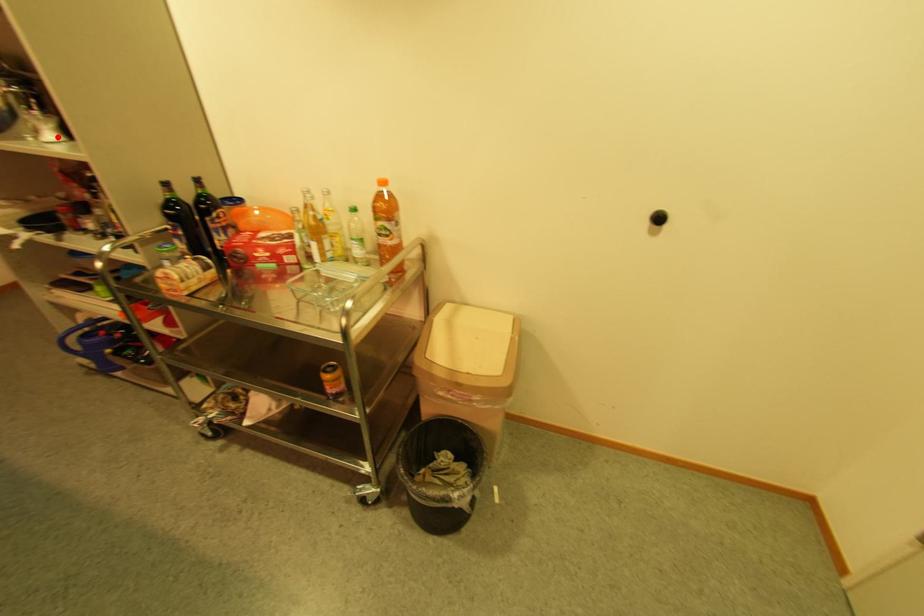
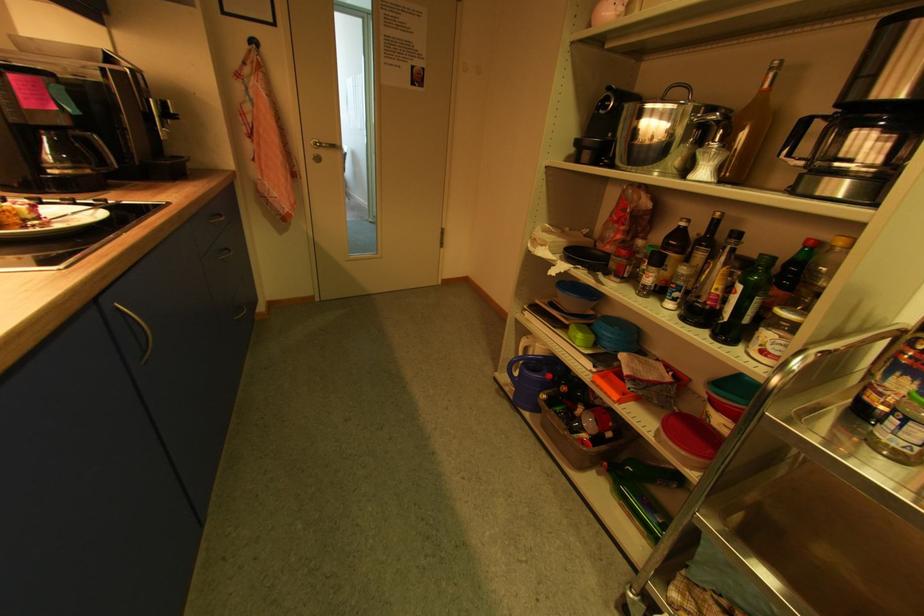
Locate, in the second image, the point that corresponds to the highlighted location in the first image.

(709, 175)